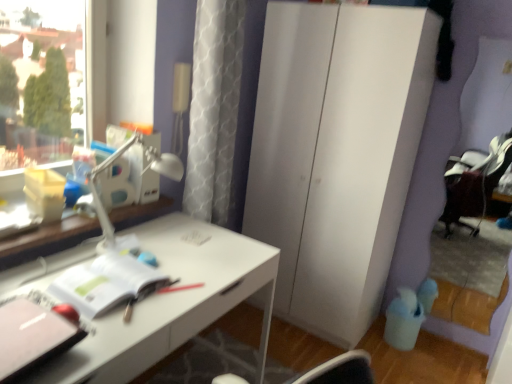
Question: Is pink matte notebook at lower left, marked as the 2th notebook in a back-to-front arrangement, wider or thinner than white plastic table lamp at upper left?

Choices:
 (A) thin
 (B) wide

Answer: (B)

Question: In terms of height, does pink matte notebook at lower left, the 1th notebook in the front-to-back sequence, look taller or shorter compared to white plastic table lamp at upper left?

Choices:
 (A) tall
 (B) short

Answer: (B)

Question: Which object is the farthest from the white glossy desk at center?

Choices:
 (A) pink matte notebook at lower left, marked as the 2th notebook in a back-to-front arrangement
 (B) white matte cabinet at center
 (C) white plastic table lamp at upper left
 (D) white matte notebook at center, the 1th notebook when ordered from back to front

Answer: (B)

Question: Considering the real-world distances, which object is farthest from the white plastic table lamp at upper left?

Choices:
 (A) white matte cabinet at center
 (B) white matte notebook at center, the 1th notebook when ordered from back to front
 (C) white glossy desk at center
 (D) pink matte notebook at lower left, the 1th notebook in the front-to-back sequence

Answer: (A)